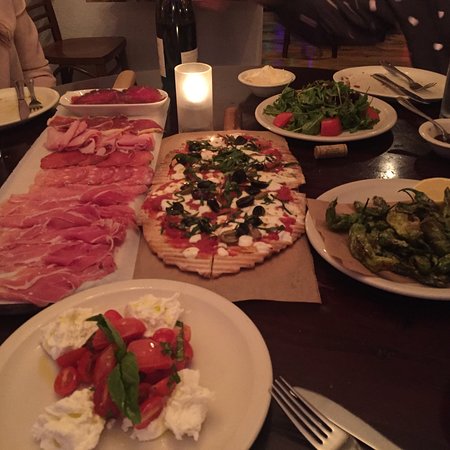
Where is `dishes`? The image size is (450, 450). dishes is located at coordinates (228, 357), (130, 256), (118, 105), (10, 104), (262, 82), (358, 82), (388, 121), (425, 131), (374, 190).